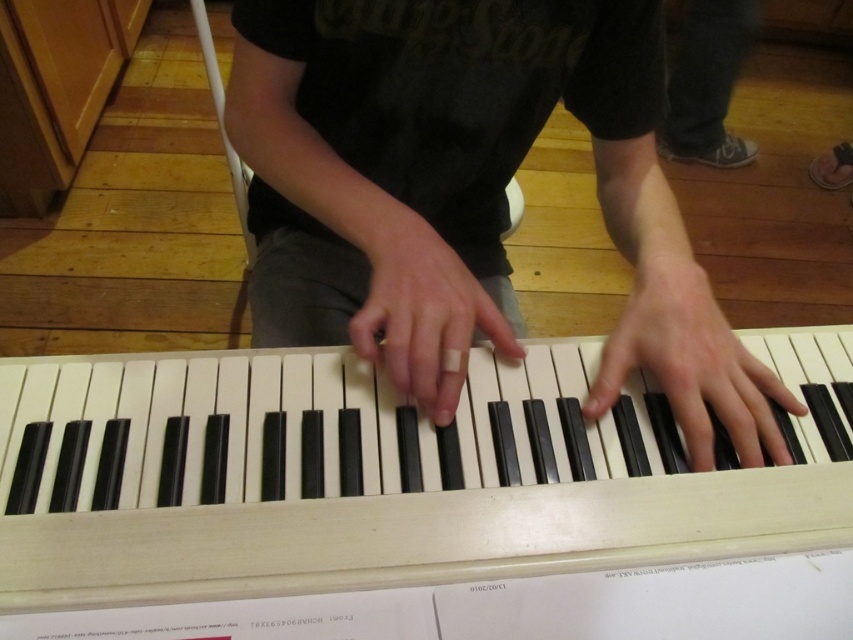
You are a photographer trying to capture a close shot of the person playing the keyboard. You want to focus on the white plastic piano at center and the white matte finger at center. Which object should you adjust your camera to focus on first if you want to ensure the object closer to you is in sharp focus?

The white matte finger at center is closer to you than the white plastic piano at center, so you should focus on the white matte finger at center first to ensure it is in sharp focus.

You are a piano teacher observing a student playing the keyboard. You notice two sets of matte black piano keys at center and satin black piano keys at center. Which set of keys is closer to the student?

The matte black piano keys at center are closer to the student because they are in front of the satin black piano keys at center.

Consider the image. You are a musician who wants to place a new stand for sheet music next to the white plastic piano at center. The stand requires 0.5 meters of space to the right of the piano. Is there enough space available based on the piano position at point 0.739, 0.451?

The white plastic piano at center is positioned at point (384, 472). However, without knowing the dimensions of the piano or the total available space in the room, it is impossible to determine if 0.5 meters of space is available to the right of the piano.